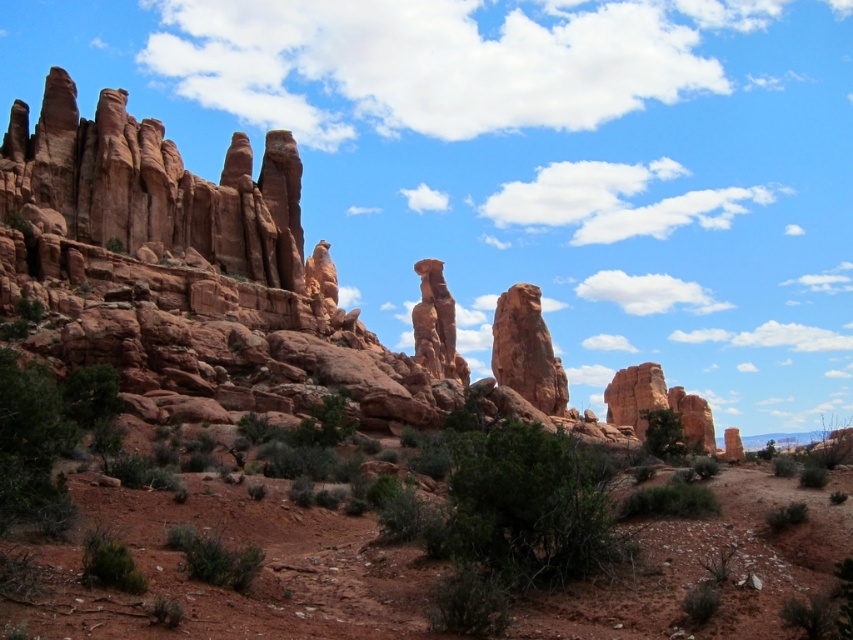
Question: Which of these objects is positioned farthest from the green leafy bush at lower right?

Choices:
 (A) rustic sandstone rock formation at center
 (B) green leafy bush at lower center
 (C) green shrub at lower center
 (D) rustic sandstone rock at center

Answer: (A)

Question: Is rustic sandstone rock at center thinner than green leafy bush at lower center?

Choices:
 (A) no
 (B) yes

Answer: (A)

Question: Which of the following is the farthest from the observer?

Choices:
 (A) (671, 444)
 (B) (142, 589)
 (C) (442, 282)
 (D) (550, 346)

Answer: (C)

Question: Which of these objects is positioned closest to the rustic sandstone rock formation at center?

Choices:
 (A) green leafy bush at lower center
 (B) green shrub at lower center
 (C) green leafy bush at lower right
 (D) green shrub at lower left

Answer: (C)

Question: Is the position of rustic sandstone rock formation at center less distant than that of green shrub at lower center?

Choices:
 (A) yes
 (B) no

Answer: (B)

Question: Can you confirm if green shrub at lower center is thinner than green leafy bush at lower center?

Choices:
 (A) no
 (B) yes

Answer: (B)